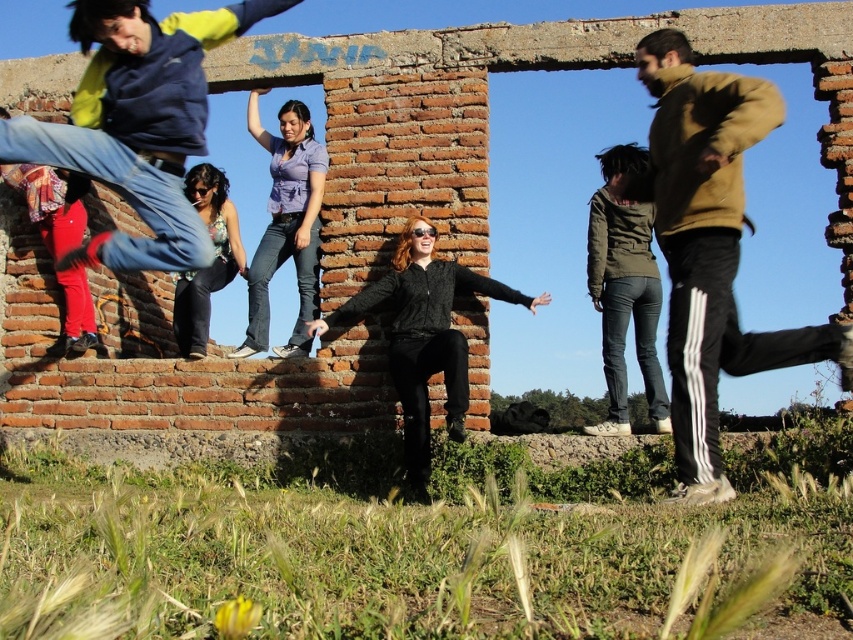
You are standing at the origin point in the image and want to locate the blue denim jeans at upper left. Which direction should you look to find them?

The blue denim jeans at upper left are located at point (137, 122), so you should look towards the upper left direction to find them.

You are standing in the grassy area and want to move towards the old brick structure. There are two people in your path. One is wearing blue denim jeans at upper left and the other is wearing a black matte sweater at center. Which person is closer to the structure?

The black matte sweater at center is closer to the old brick structure because it is positioned between you and the blue denim jeans at upper left, which is further to the left.

You are a photographer planning to take a group photo of the olive green fabric jacket at upper right and the denim jeans at center. The minimum distance required for your camera to focus properly is 60 feet. Based on the scene description, will the camera be able to focus on both subjects simultaneously?

The olive green fabric jacket at upper right is 61.01 feet from the denim jeans at center, which exceeds the minimum 60 feet requirement. Therefore, the camera should be able to focus on both subjects simultaneously.